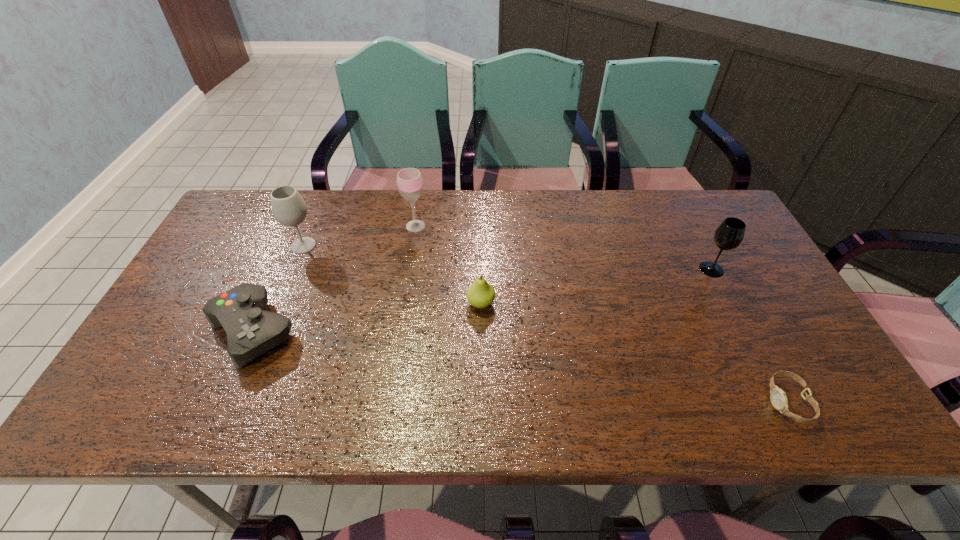
Locate an element on the screen. the fifth nearest object is located at coordinates (288, 207).

At what (x,y) coordinates should I click in order to perform the action: click on the leftmost wineglass. Please return your answer as a coordinate pair (x, y). Looking at the image, I should click on (288, 207).

I want to click on the farthest object, so click(409, 180).

You are a GUI agent. You are given a task and a screenshot of the screen. Output one action in this format:
    pyautogui.click(x=<x>, y=<y>)
    Task: Click on the third object from left to right
    The width and height of the screenshot is (960, 540).
    Given the screenshot: What is the action you would take?
    pyautogui.click(x=409, y=180)

At what (x,y) coordinates should I click in order to perform the action: click on the nearest wineglass. Please return your answer as a coordinate pair (x, y). Looking at the image, I should click on (729, 235).

At what (x,y) coordinates should I click in order to perform the action: click on the rightmost wineglass. Please return your answer as a coordinate pair (x, y). This screenshot has height=540, width=960. Looking at the image, I should click on (729, 235).

You are a GUI agent. You are given a task and a screenshot of the screen. Output one action in this format:
    pyautogui.click(x=<x>, y=<y>)
    Task: Click on the pear
    The image size is (960, 540).
    Given the screenshot: What is the action you would take?
    pyautogui.click(x=481, y=294)

You are a GUI agent. You are given a task and a screenshot of the screen. Output one action in this format:
    pyautogui.click(x=<x>, y=<y>)
    Task: Click on the third shortest object
    
    Given the screenshot: What is the action you would take?
    pyautogui.click(x=481, y=294)

The width and height of the screenshot is (960, 540). What are the coordinates of `control` in the screenshot? It's located at (251, 331).

The width and height of the screenshot is (960, 540). What are the coordinates of `the shortest object` in the screenshot? It's located at (778, 397).